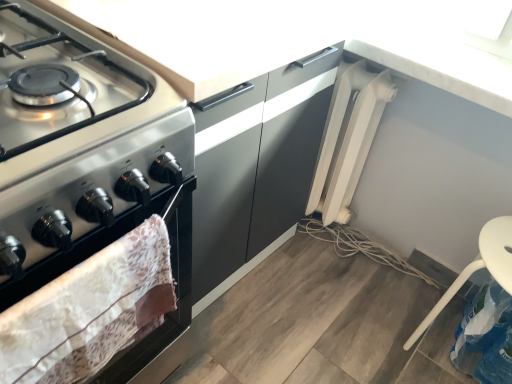
What is the approximate height of white plastic radiator at lower right?

white plastic radiator at lower right is 2.62 inches tall.

I want to click on matte silver oven at left, so click(104, 302).

The height and width of the screenshot is (384, 512). What do you see at coordinates (479, 267) in the screenshot?
I see `white plastic chair at lower right` at bounding box center [479, 267].

The image size is (512, 384). I want to click on white plastic radiator at lower right, so click(360, 247).

Is white plastic radiator at upper right at the back of white plastic radiator at lower right?

No, white plastic radiator at lower right's orientation is not away from white plastic radiator at upper right.

What's the angular difference between white plastic radiator at lower right and white plastic radiator at upper right's facing directions?

The angle between the facing direction of white plastic radiator at lower right and the facing direction of white plastic radiator at upper right is 8.98e-05 degrees.

From a real-world perspective, is white plastic radiator at lower right over white plastic radiator at upper right?

No.

Between white plastic radiator at lower right and white plastic radiator at upper right, which one has larger width?

With larger width is white plastic radiator at lower right.

Based on the photo, which object is closer to the camera taking this photo, white plastic chair at lower right or white plastic radiator at upper right?

white plastic chair at lower right is more forward.

Considering the sizes of objects white plastic chair at lower right and white plastic radiator at upper right in the image provided, who is taller, white plastic chair at lower right or white plastic radiator at upper right?

white plastic radiator at upper right.

In terms of width, does white plastic chair at lower right look wider or thinner when compared to white plastic radiator at upper right?

Considering their sizes, white plastic chair at lower right looks broader than white plastic radiator at upper right.

Which is in front, point (447, 295) or point (388, 89)?

The point (447, 295) is closer.

From a real-world perspective, is matte silver oven at left below white plastic radiator at lower right?

Actually, matte silver oven at left is physically above white plastic radiator at lower right in the real world.

What's the angular difference between matte silver oven at left and white plastic radiator at lower right's facing directions?

They differ by 87.9 degrees in their facing directions.

Does point (129, 303) come farther from viewer compared to point (356, 236)?

No.

Which object is thinner, matte silver oven at left or white plastic radiator at lower right?

matte silver oven at left is thinner.

Does white plastic radiator at upper right have a lesser height compared to matte silver oven at left?

No, white plastic radiator at upper right is not shorter than matte silver oven at left.

Does white plastic radiator at upper right lie behind matte silver oven at left?

Yes, white plastic radiator at upper right is further from the viewer.

Would you say white plastic radiator at upper right contains matte silver oven at left?

No, matte silver oven at left is not inside white plastic radiator at upper right.

Considering the positions of objects white plastic radiator at upper right and matte silver oven at left in the image provided, who is more to the right, white plastic radiator at upper right or matte silver oven at left?

white plastic radiator at upper right.

Which is correct: white plastic chair at lower right is inside white plastic radiator at lower right, or outside of it?

white plastic chair at lower right exists outside the volume of white plastic radiator at lower right.

Considering the positions of objects white plastic chair at lower right and white plastic radiator at lower right in the image provided, who is more to the right, white plastic chair at lower right or white plastic radiator at lower right?

Positioned to the right is white plastic chair at lower right.

From a real-world perspective, is white plastic chair at lower right physically located above or below white plastic radiator at lower right?

white plastic chair at lower right is situated higher than white plastic radiator at lower right in the real world.

Image resolution: width=512 pixels, height=384 pixels. Identify the location of oven below the white plastic radiator at upper right (from the image's perspective). (104, 302).

Does matte silver oven at left touch white plastic radiator at upper right?

They are not placed beside each other.

Considering the sizes of matte silver oven at left and white plastic radiator at upper right in the image, is matte silver oven at left wider or thinner than white plastic radiator at upper right?

matte silver oven at left is thinner than white plastic radiator at upper right.

Who is taller, matte silver oven at left or white plastic radiator at upper right?

white plastic radiator at upper right is taller.

Is point (348, 247) closer or farther from the camera than point (500, 269)?

Point (348, 247) is farther from the camera than point (500, 269).

Is white plastic radiator at lower right closer to camera compared to white plastic chair at lower right?

No, white plastic radiator at lower right is further to the viewer.

Is white plastic radiator at lower right to the left or to the right of white plastic chair at lower right in the image?

Based on their positions, white plastic radiator at lower right is located to the left of white plastic chair at lower right.

In the image, there is a white plastic radiator at upper right. Find the location of `string below it (from the image's perspective)`. string below it (from the image's perspective) is located at coordinates (360, 247).

There is a white plastic chair at lower right. At what (x,y) coordinates should I click in order to perform the action: click on appliance above it (from a real-world perspective). Please return your answer as a coordinate pair (x, y). The width and height of the screenshot is (512, 384). Looking at the image, I should click on (348, 138).

Considering their positions, is white plastic radiator at upper right positioned further to white plastic chair at lower right than white plastic radiator at lower right?

white plastic radiator at upper right is further to white plastic chair at lower right.

Based on their spatial positions, is white plastic chair at lower right or matte silver oven at left further from white plastic radiator at lower right?

matte silver oven at left is positioned further to the anchor white plastic radiator at lower right.

Considering their positions, is white plastic radiator at upper right positioned further to white plastic radiator at lower right than white plastic chair at lower right?

Answer: white plastic chair at lower right is further to white plastic radiator at lower right.

Considering their positions, is matte silver oven at left positioned closer to white plastic radiator at upper right than white plastic chair at lower right?

Result: Among the two, white plastic chair at lower right is located nearer to white plastic radiator at upper right.

Which object lies further to the anchor point white plastic radiator at upper right, white plastic radiator at lower right or white plastic chair at lower right?

white plastic chair at lower right is positioned further to the anchor white plastic radiator at upper right.

From the image, which object appears to be farther from matte silver oven at left, white plastic radiator at upper right or white plastic radiator at lower right?

white plastic radiator at lower right.

Based on their spatial positions, is white plastic radiator at upper right or matte silver oven at left closer to white plastic radiator at lower right?

Among the two, white plastic radiator at upper right is located nearer to white plastic radiator at lower right.

When comparing their distances from white plastic radiator at lower right, does matte silver oven at left or white plastic radiator at upper right seem further?

Among the two, matte silver oven at left is located further to white plastic radiator at lower right.

Identify the location of appliance between matte silver oven at left and white plastic radiator at lower right along the z-axis. The width and height of the screenshot is (512, 384). (348, 138).

Where is `chair between matte silver oven at left and white plastic radiator at lower right from front to back`? chair between matte silver oven at left and white plastic radiator at lower right from front to back is located at coordinates (479, 267).

Find the location of `appliance between matte silver oven at left and white plastic chair at lower right from left to right`. appliance between matte silver oven at left and white plastic chair at lower right from left to right is located at coordinates (348, 138).

This screenshot has width=512, height=384. In order to click on appliance located between white plastic chair at lower right and white plastic radiator at lower right in the depth direction in this screenshot , I will do click(348, 138).